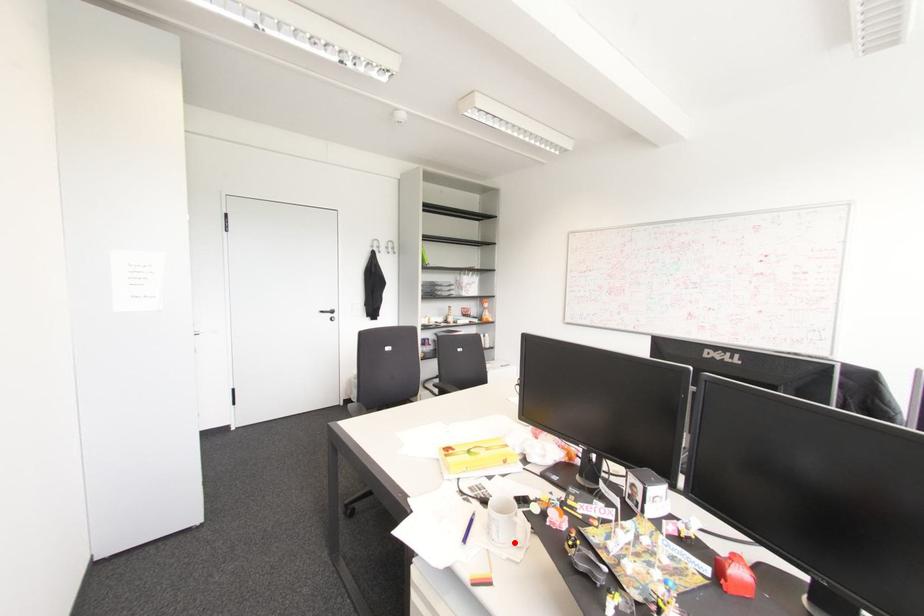
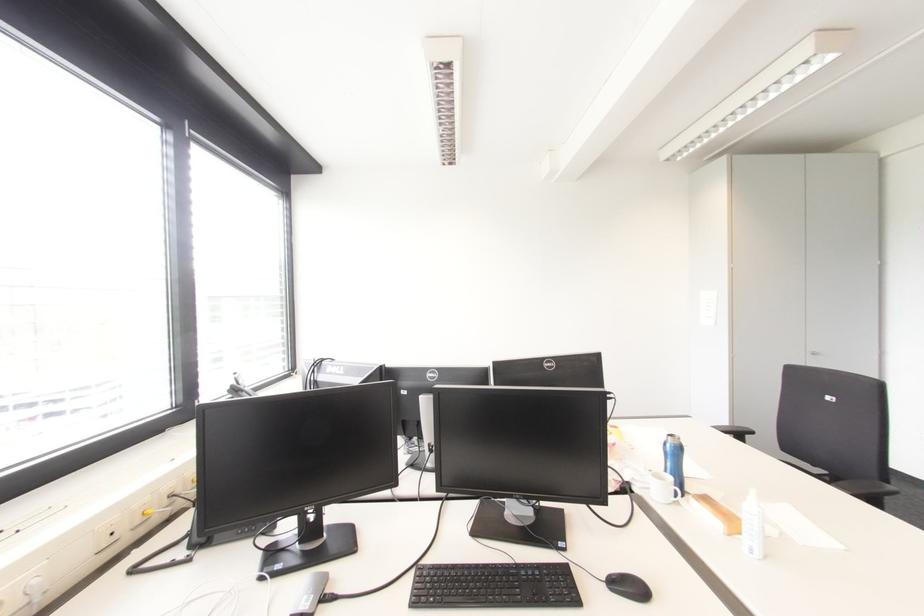
Question: I am providing you with two images of the same scene from different viewpoints. A red point is marked on the first image. Can you still see the location of the red point in image 2?

Choices:
 (A) Yes
 (B) No

Answer: (B)